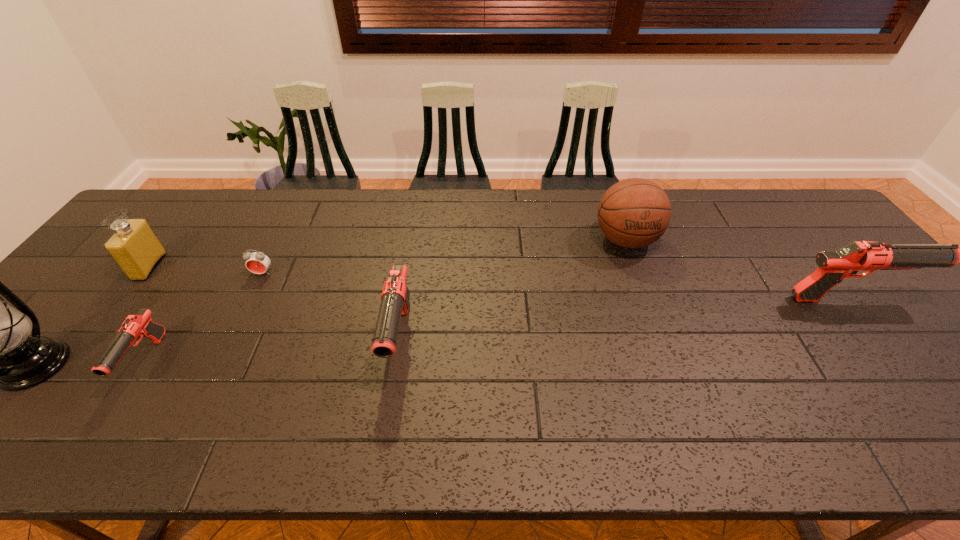
At what (x,y) coordinates should I click in order to perform the action: click on vacant space located on the side with brand label of the second object from right to left. Please return your answer as a coordinate pair (x, y). This screenshot has width=960, height=540. Looking at the image, I should click on (639, 278).

You are a GUI agent. You are given a task and a screenshot of the screen. Output one action in this format:
    pyautogui.click(x=<x>, y=<y>)
    Task: Click on the vacant point located on the front-facing side of the perfume
    The height and width of the screenshot is (540, 960).
    Given the screenshot: What is the action you would take?
    pyautogui.click(x=226, y=267)

Image resolution: width=960 pixels, height=540 pixels. In order to click on object that is at the far edge in this screenshot , I will do `click(633, 213)`.

Where is `object at the left edge`? The width and height of the screenshot is (960, 540). object at the left edge is located at coordinates (135, 248).

This screenshot has width=960, height=540. Find the location of `object at the right edge`. object at the right edge is located at coordinates (833, 266).

Locate an element on the screen. This screenshot has width=960, height=540. free region at the far edge of the desktop is located at coordinates (744, 219).

Find the location of a particular element. vacant space at the near edge of the desktop is located at coordinates (132, 385).

In order to click on free space at the far right corner of the desktop in this screenshot , I will do `click(825, 221)`.

This screenshot has height=540, width=960. Find the location of `empty location between the rightmost object and the leftmost gun`. empty location between the rightmost object and the leftmost gun is located at coordinates (497, 330).

You are a GUI agent. You are given a task and a screenshot of the screen. Output one action in this format:
    pyautogui.click(x=<x>, y=<y>)
    Task: Click on the empty space that is in between the rightmost gun and the second object from right to left
    The image size is (960, 540).
    Given the screenshot: What is the action you would take?
    pyautogui.click(x=737, y=269)